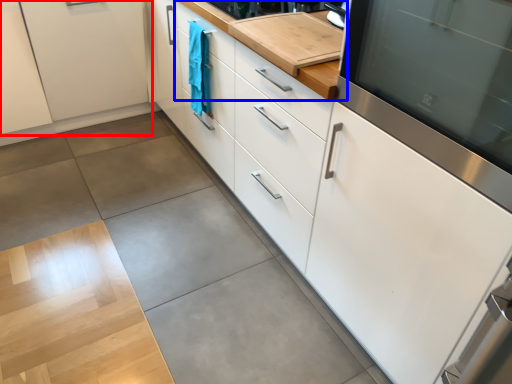
Question: Which object appears closest to the camera in this image, cabinetry (highlighted by a red box) or countertop (highlighted by a blue box)?

Choices:
 (A) cabinetry
 (B) countertop

Answer: (B)